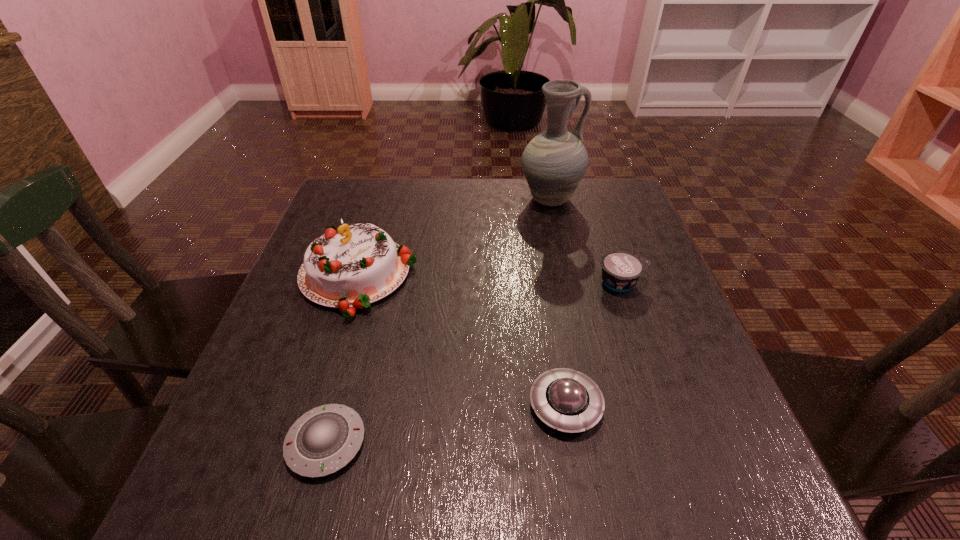
This screenshot has height=540, width=960. Find the location of `free space at the far edge of the desktop`. free space at the far edge of the desktop is located at coordinates (482, 198).

The image size is (960, 540). Find the location of `vacant space at the near edge of the desktop`. vacant space at the near edge of the desktop is located at coordinates (416, 485).

Locate an element on the screen. Image resolution: width=960 pixels, height=540 pixels. vacant region at the left edge of the desktop is located at coordinates (305, 249).

Identify the location of free space at the right edge. (620, 351).

The image size is (960, 540). Identify the location of vacant space at the far left corner of the desktop. (346, 219).

This screenshot has height=540, width=960. I want to click on blank area at the near left corner, so click(183, 520).

Find the location of a particular element. This screenshot has height=540, width=960. free space that is in between the yogurt and the right saucer is located at coordinates (593, 344).

Identify the location of vacant area between the taller saucer and the pitcher. (558, 303).

Where is `unoccupied position between the left saucer and the cake`? The image size is (960, 540). unoccupied position between the left saucer and the cake is located at coordinates (342, 360).

This screenshot has width=960, height=540. What are the coordinates of `vacant space in between the yogurt and the pitcher` in the screenshot? It's located at (586, 241).